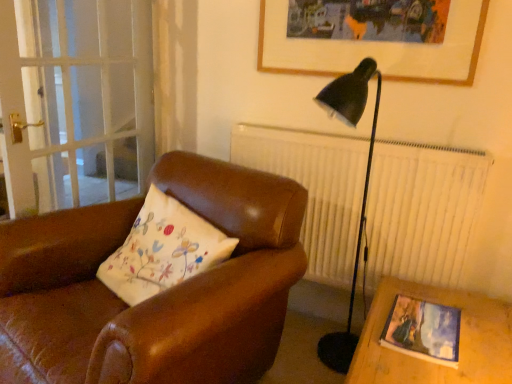
Question: Based on their sizes in the image, would you say matte wooden picture frame at lower right, which ranks as the 2th picture frame in top-to-bottom order, is bigger or smaller than transparent glass screen door at left?

Choices:
 (A) small
 (B) big

Answer: (A)

Question: Considering the positions of matte wooden picture frame at lower right, which ranks as the 2th picture frame in top-to-bottom order, and transparent glass screen door at left in the image, is matte wooden picture frame at lower right, which ranks as the 2th picture frame in top-to-bottom order, taller or shorter than transparent glass screen door at left?

Choices:
 (A) tall
 (B) short

Answer: (B)

Question: Estimate the real-world distances between objects in this image. Which object is farther from the wooden picture frame at upper center, acting as the 2th picture frame starting from the front?

Choices:
 (A) brown leather chair at center
 (B) transparent glass screen door at left
 (C) matte wooden picture frame at lower right, acting as the 1th picture frame starting from the front

Answer: (B)

Question: Which is nearer to the transparent glass screen door at left?

Choices:
 (A) wooden picture frame at upper center, which is the 1th picture frame from top to bottom
 (B) matte wooden picture frame at lower right, acting as the 1th picture frame starting from the front
 (C) brown leather chair at center

Answer: (C)